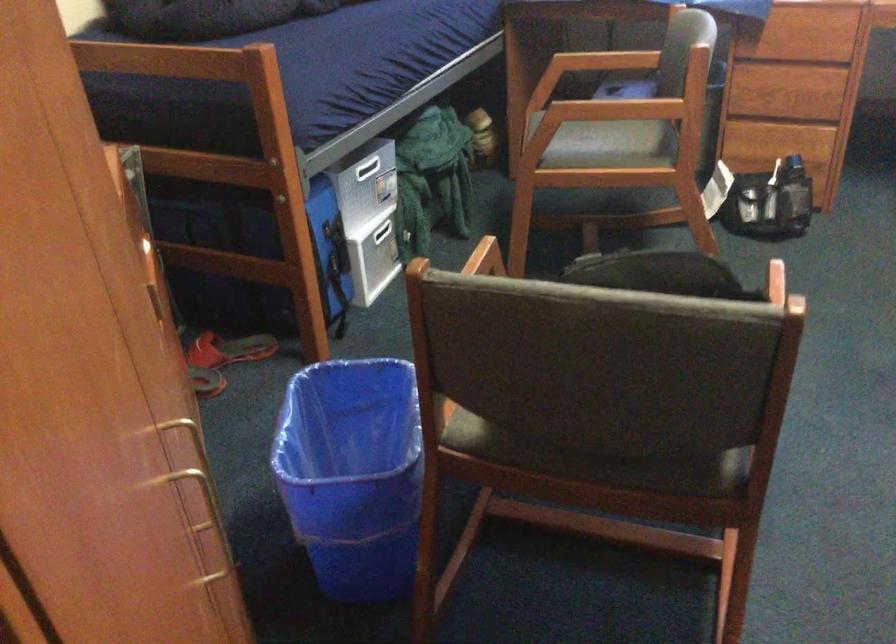
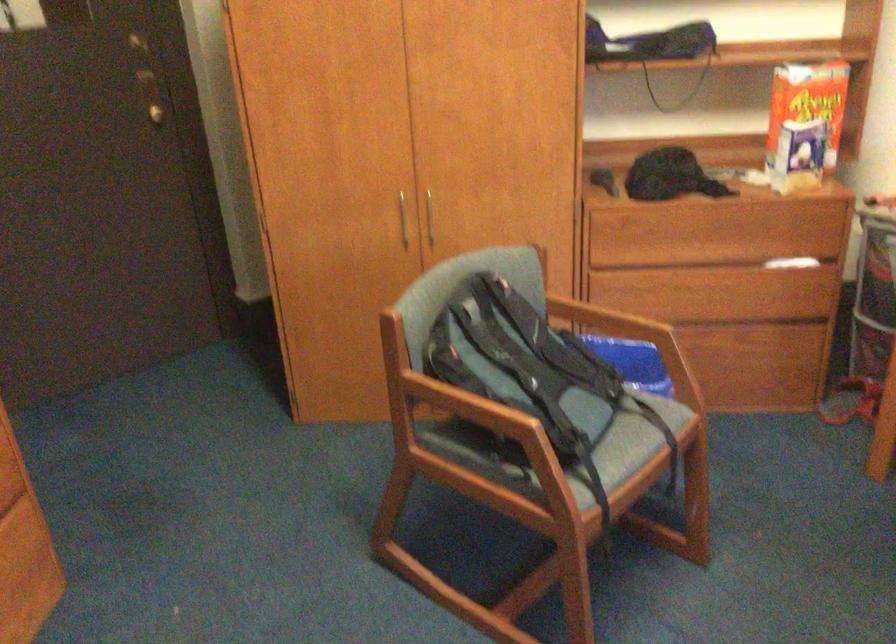
Question: I am providing you with two images of the same scene from different viewpoints. Please identify which objects are invisible in image2.

Choices:
 (A) inset drawer handle
 (B) silver cabinet handle
 (C) black backpack
 (D) chair sitting surface

Answer: (D)